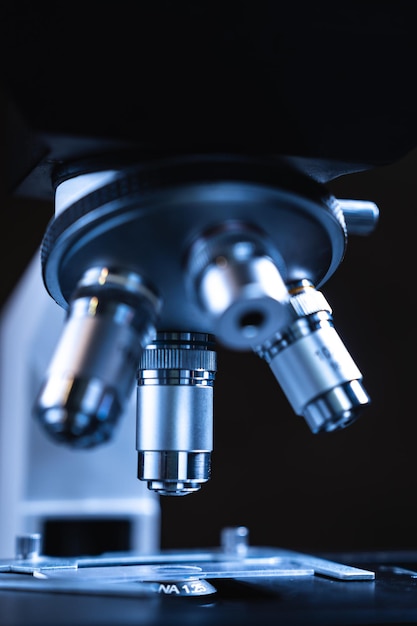
The width and height of the screenshot is (417, 626). In order to click on microscope base in this screenshot , I will do pyautogui.click(x=149, y=546).